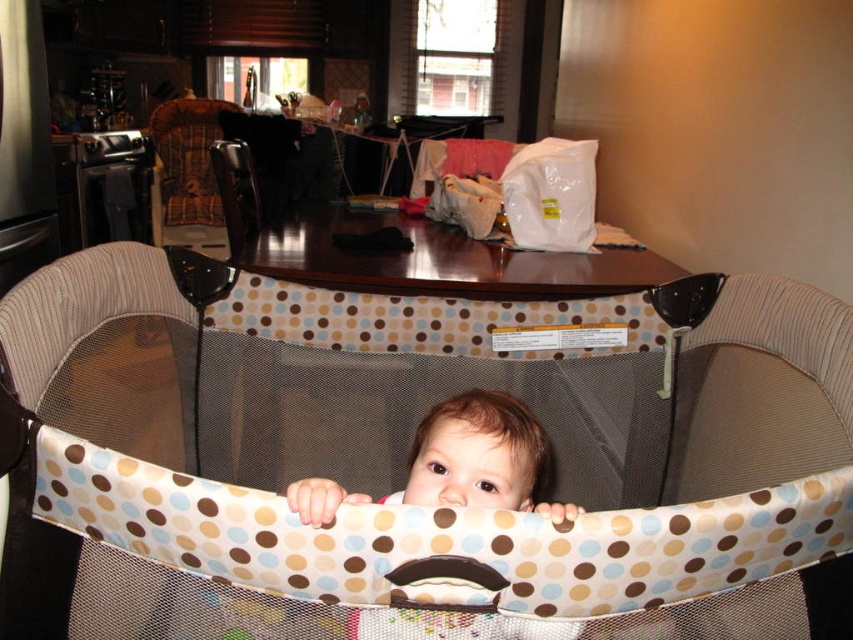
Question: Does brown dotted fabric playpen at center appear under wooden chair at center?

Choices:
 (A) no
 (B) yes

Answer: (B)

Question: Does brown dotted fabric playpen at center come in front of wooden chair at center?

Choices:
 (A) no
 (B) yes

Answer: (B)

Question: Which of the following is the farthest from the observer?

Choices:
 (A) brown fabric baby at center
 (B) brown dotted fabric playpen at center

Answer: (B)

Question: Does brown dotted fabric playpen at center appear under wooden chair at center?

Choices:
 (A) no
 (B) yes

Answer: (B)

Question: Which point is farther to the camera?

Choices:
 (A) (241, 189)
 (B) (291, 492)
 (C) (166, 152)

Answer: (C)

Question: Among these objects, which one is nearest to the camera?

Choices:
 (A) brown dotted fabric playpen at center
 (B) plaid fabric feeding chair at upper left

Answer: (A)